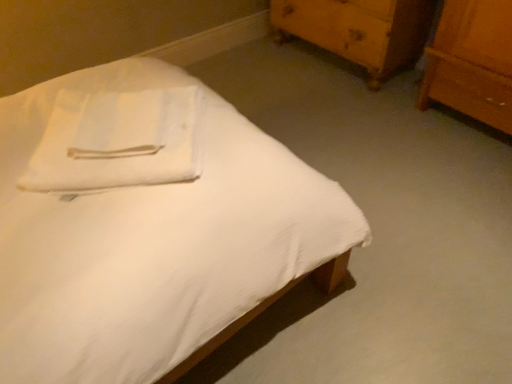
At what (x,y) coordinates should I click in order to perform the action: click on vacant space in front of wooden chest of drawers at upper right. Please return your answer as a coordinate pair (x, y). Looking at the image, I should click on (354, 118).